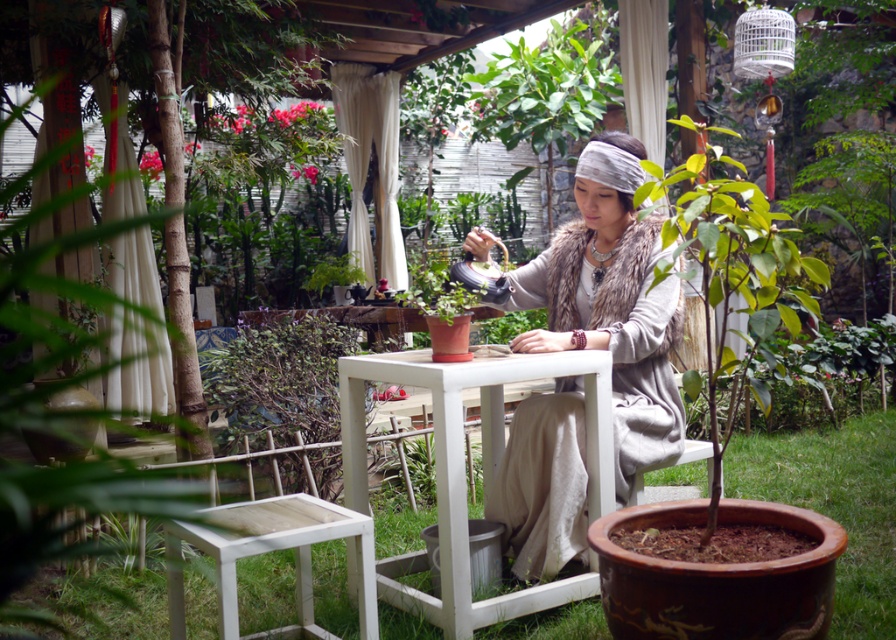
Is fur vest at center smaller than white wooden table at center?

Incorrect, fur vest at center is not smaller in size than white wooden table at center.

The image size is (896, 640). I want to click on fur vest at center, so click(x=612, y=304).

Can you confirm if green leafy plant at lower left is smaller than white wood stool at lower left?

Actually, green leafy plant at lower left might be larger than white wood stool at lower left.

Describe the element at coordinates (278, 380) in the screenshot. This screenshot has width=896, height=640. I see `green leafy plant at lower left` at that location.

You are a GUI agent. You are given a task and a screenshot of the screen. Output one action in this format:
    pyautogui.click(x=<x>, y=<y>)
    Task: Click on the green leafy plant at lower left
    The width and height of the screenshot is (896, 640).
    Given the screenshot: What is the action you would take?
    pyautogui.click(x=278, y=380)

Can you confirm if white wooden table at center is bigger than green leafy plant at lower left?

Actually, white wooden table at center might be smaller than green leafy plant at lower left.

Based on the photo, which of these two, white wooden table at center or green leafy plant at lower left, stands shorter?

With less height is white wooden table at center.

Where is `white wooden table at center`? white wooden table at center is located at coordinates tap(464, 472).

Where is `white wooden table at center`? white wooden table at center is located at coordinates (464, 472).